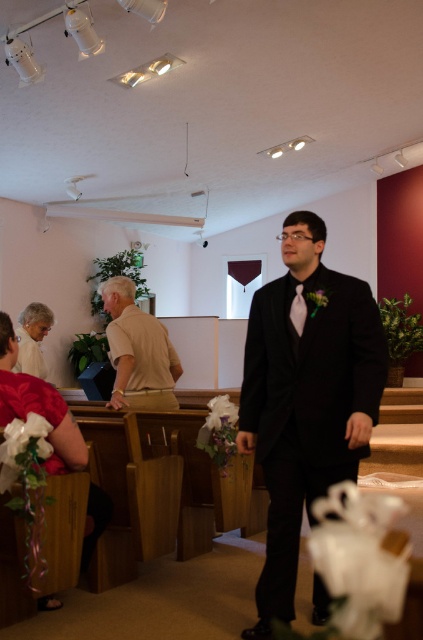
Question: Estimate the real-world distances between objects in this image. Which object is farther from the black satin suit at center?

Choices:
 (A) matte white dress at lower left
 (B) white satin tie at center
 (C) white satin dress at lower left

Answer: (C)

Question: Can you confirm if beige cotton shirt at center is thinner than white satin dress at lower left?

Choices:
 (A) no
 (B) yes

Answer: (A)

Question: Can you confirm if beige cotton shirt at center is smaller than white satin dress at lower left?

Choices:
 (A) yes
 (B) no

Answer: (B)

Question: Among these points, which one is nearest to the camera?

Choices:
 (A) (38, 332)
 (B) (60, 413)

Answer: (B)

Question: Can you confirm if beige cotton shirt at center is wider than white satin tie at center?

Choices:
 (A) yes
 (B) no

Answer: (A)

Question: Which object appears closest to the camera in this image?

Choices:
 (A) black satin suit at center
 (B) beige cotton shirt at center

Answer: (A)